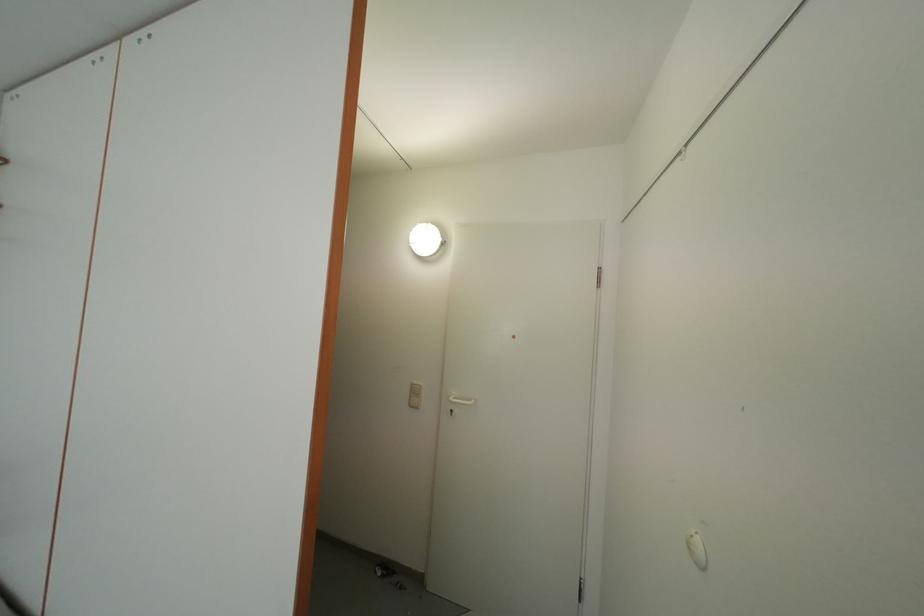
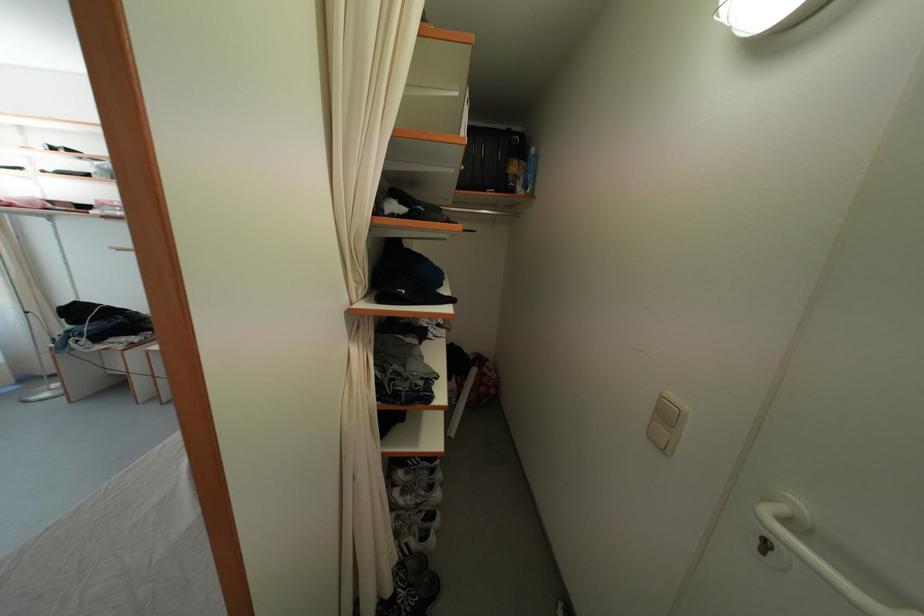
Find the pixel in the second image that matches the point at 421,398 in the first image.

(672, 421)